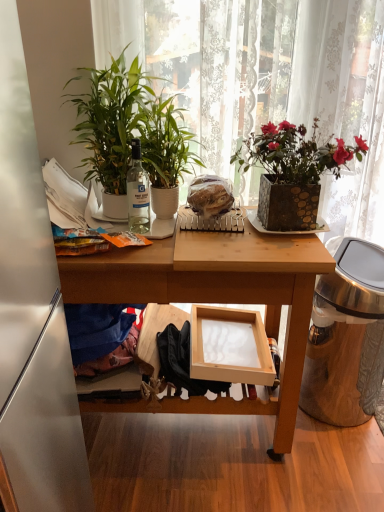
Locate an element on the screen. free spot in front of clear glass bottle at center is located at coordinates (145, 253).